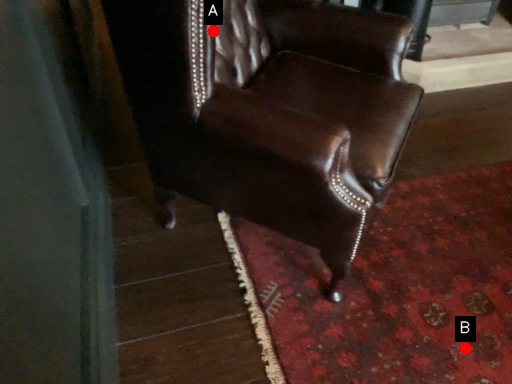
Question: Two points are circled on the image, labeled by A and B beside each circle. Which point appears closest to the camera in this image?

Choices:
 (A) A is closer
 (B) B is closer

Answer: (A)